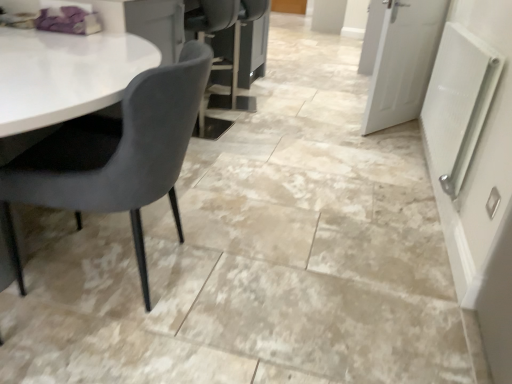
Locate an element on the screen. The width and height of the screenshot is (512, 384). free space in front of white matte door at upper right, acting as the 2th door starting from the back is located at coordinates (379, 147).